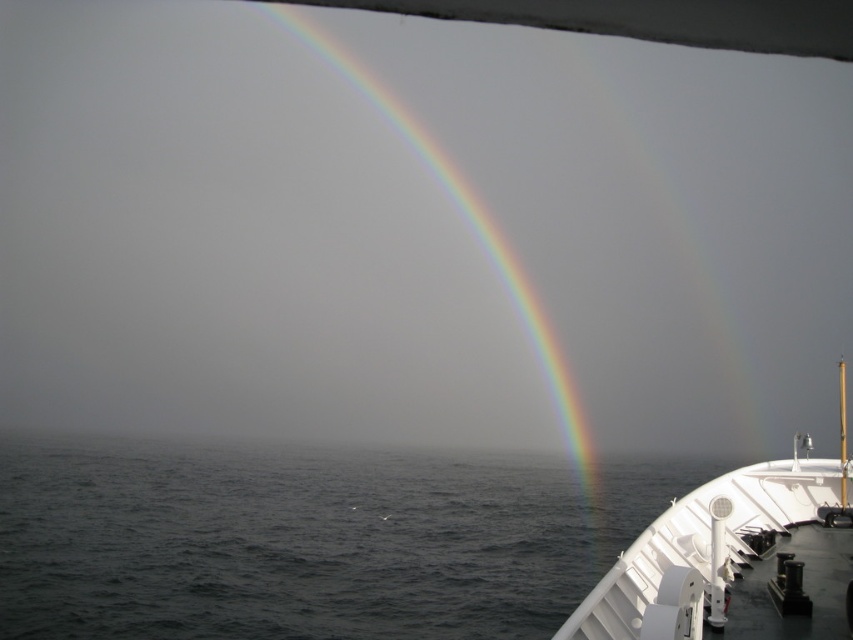
Does point (10, 484) lie in front of point (316, 32)?

Yes.

Based on the photo, measure the distance between dark blue water at lower left and camera.

The distance of dark blue water at lower left from camera is 19.82 meters.

Find the location of a particular element. The image size is (853, 640). dark blue water at lower left is located at coordinates (306, 540).

Is dark blue water at lower left smaller than white matte boat at lower right?

Actually, dark blue water at lower left might be larger than white matte boat at lower right.

Find the location of a particular element. dark blue water at lower left is located at coordinates (306, 540).

Can you confirm if white matte boat at lower right is positioned above rainbow at upper center?

No, white matte boat at lower right is not above rainbow at upper center.

I want to click on white matte boat at lower right, so click(737, 557).